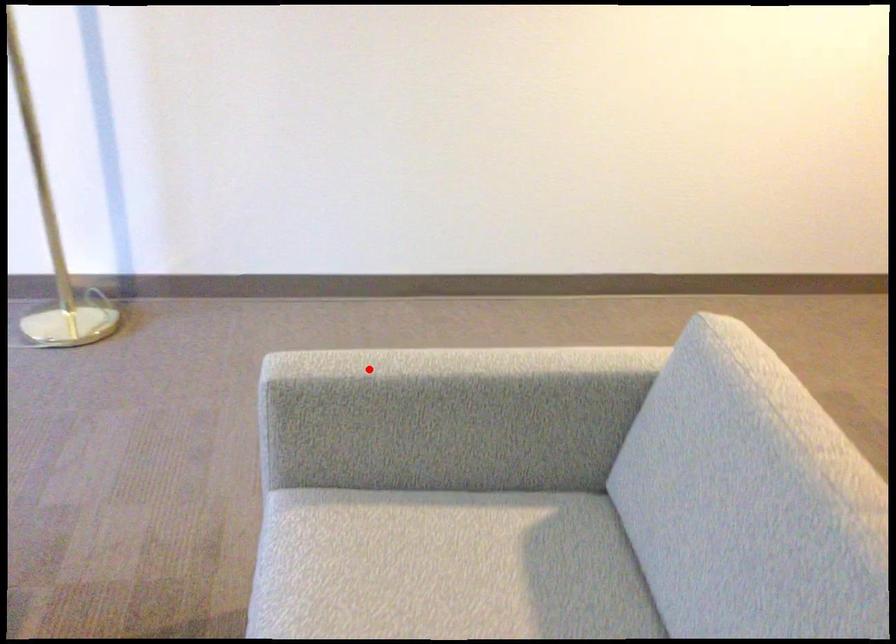
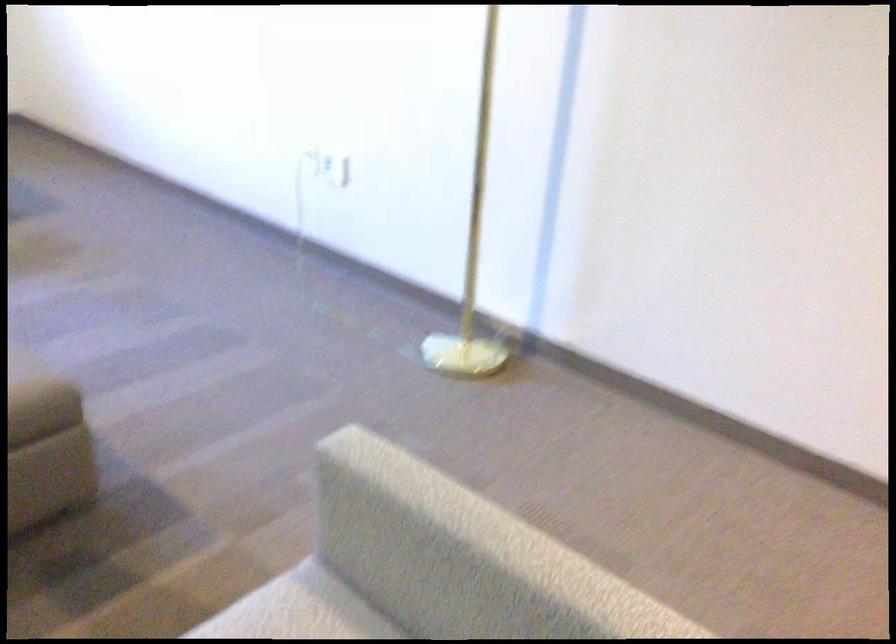
In the second image, find the point that corresponds to the highlighted location in the first image.

(421, 489)